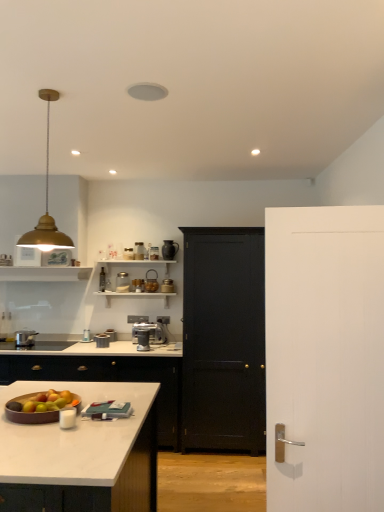
Where is `empty space that is ontop of green matte apple at lower left (from a real-world perspective)`? This screenshot has width=384, height=512. empty space that is ontop of green matte apple at lower left (from a real-world perspective) is located at coordinates (51, 400).